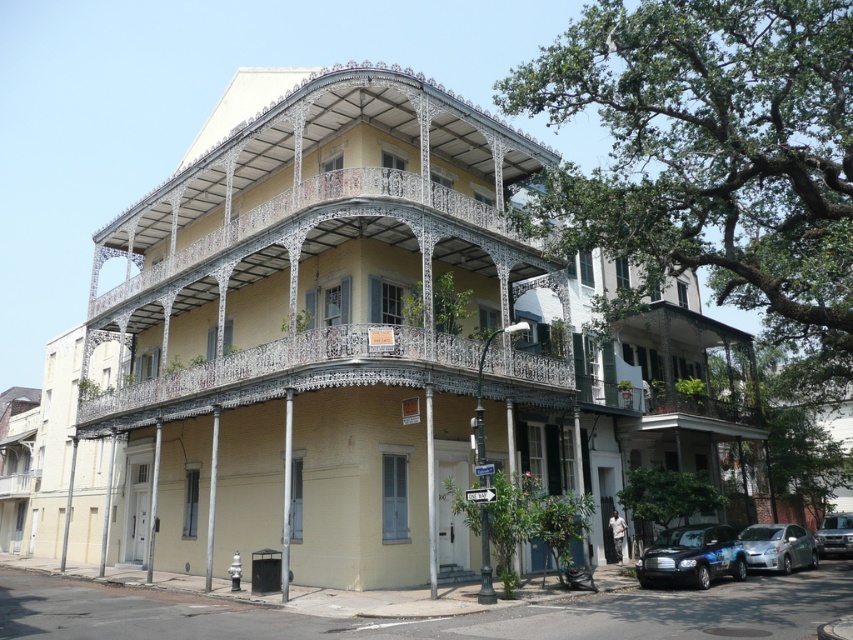
Question: Which of these objects is positioned farthest from the metallic silver suv at lower right?

Choices:
 (A) white wrought iron balcony at center
 (B) shiny blue car at lower right
 (C) satin silver car at lower right

Answer: (A)

Question: Estimate the real-world distances between objects in this image. Which object is closer to the metallic silver suv at lower right?

Choices:
 (A) satin silver car at lower right
 (B) white wrought iron balcony at center

Answer: (A)

Question: Can you confirm if white wrought iron balcony at center is smaller than shiny blue car at lower right?

Choices:
 (A) yes
 (B) no

Answer: (B)

Question: Among these points, which one is farthest from the camera?

Choices:
 (A) (838, 520)
 (B) (746, 538)
 (C) (335, 195)
 (D) (693, 531)

Answer: (A)

Question: Is white wrought iron balcony at center below shiny blue car at lower right?

Choices:
 (A) no
 (B) yes

Answer: (A)

Question: Does white wrought iron balcony at center lie in front of satin silver car at lower right?

Choices:
 (A) no
 (B) yes

Answer: (B)